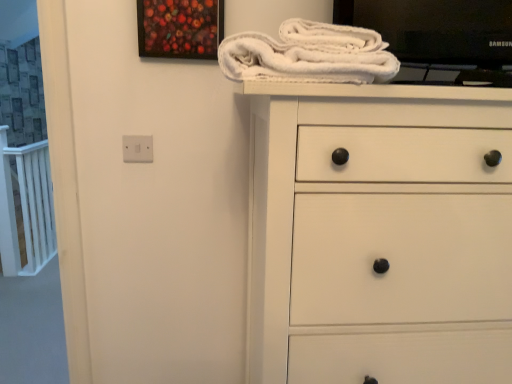
Question: Is white matte chest of drawers at center at the back of white fluffy bath towel at upper center?

Choices:
 (A) yes
 (B) no

Answer: (B)

Question: Does white fluffy bath towel at upper center appear on the left side of white matte chest of drawers at center?

Choices:
 (A) yes
 (B) no

Answer: (A)

Question: From a real-world perspective, is white fluffy bath towel at upper center located higher than white matte chest of drawers at center?

Choices:
 (A) no
 (B) yes

Answer: (B)

Question: From the image's perspective, does white fluffy bath towel at upper center appear higher than white matte chest of drawers at center?

Choices:
 (A) no
 (B) yes

Answer: (B)

Question: Does white fluffy bath towel at upper center come behind white matte chest of drawers at center?

Choices:
 (A) no
 (B) yes

Answer: (B)

Question: Is white fluffy bath towel at upper center at the right side of white matte chest of drawers at center?

Choices:
 (A) no
 (B) yes

Answer: (A)

Question: Is painted wood picture frame at upper center taller than white matte chest of drawers at center?

Choices:
 (A) yes
 (B) no

Answer: (B)

Question: From the image's perspective, is painted wood picture frame at upper center located above white matte chest of drawers at center?

Choices:
 (A) no
 (B) yes

Answer: (B)

Question: Is painted wood picture frame at upper center bigger than white matte chest of drawers at center?

Choices:
 (A) yes
 (B) no

Answer: (B)

Question: Are painted wood picture frame at upper center and white matte chest of drawers at center far apart?

Choices:
 (A) no
 (B) yes

Answer: (A)

Question: Is painted wood picture frame at upper center completely or partially outside of white matte chest of drawers at center?

Choices:
 (A) yes
 (B) no

Answer: (A)

Question: Considering the relative positions of painted wood picture frame at upper center and white matte chest of drawers at center in the image provided, is painted wood picture frame at upper center in front of white matte chest of drawers at center?

Choices:
 (A) yes
 (B) no

Answer: (B)

Question: Does white matte chest of drawers at center have a lesser height compared to painted wood picture frame at upper center?

Choices:
 (A) yes
 (B) no

Answer: (B)